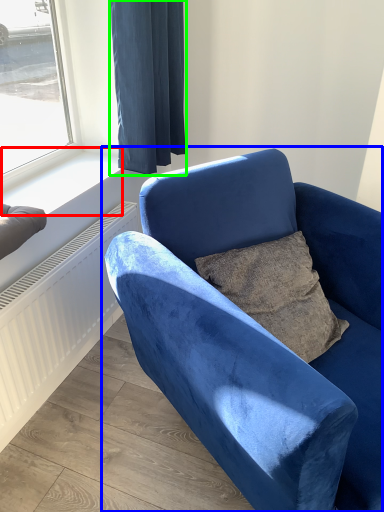
Question: Based on their relative distances, which object is nearer to window sill (highlighted by a red box)? Choose from chair (highlighted by a blue box) and curtain (highlighted by a green box).

Choices:
 (A) chair
 (B) curtain

Answer: (B)